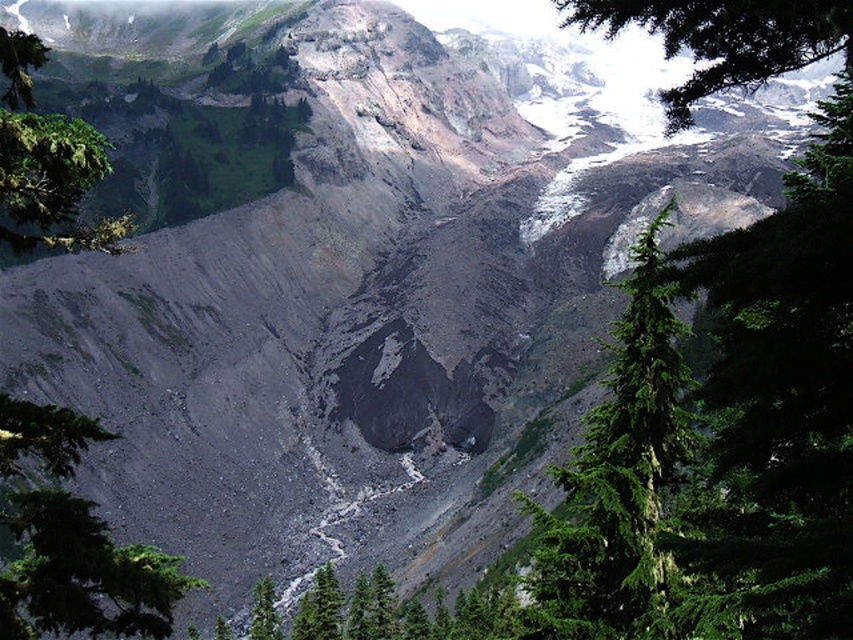
Question: Is green textured tree at lower left below green leafy tree at upper left?

Choices:
 (A) yes
 (B) no

Answer: (A)

Question: Which object is positioned closest to the green textured tree at center?

Choices:
 (A) green leafy tree at upper left
 (B) green textured tree at lower left
 (C) green textured pine tree at upper right

Answer: (B)

Question: Does green textured tree at lower left appear on the right side of green leafy tree at upper left?

Choices:
 (A) yes
 (B) no

Answer: (A)

Question: Can you confirm if green textured pine tree at upper right is wider than green leafy tree at upper left?

Choices:
 (A) yes
 (B) no

Answer: (B)

Question: Estimate the real-world distances between objects in this image. Which object is closer to the green textured tree at center?

Choices:
 (A) green textured tree at lower left
 (B) green textured pine tree at upper right

Answer: (A)

Question: Which of these objects is positioned closest to the green leafy tree at upper left?

Choices:
 (A) green textured tree at lower left
 (B) green textured pine tree at upper right
 (C) green textured tree at center

Answer: (A)